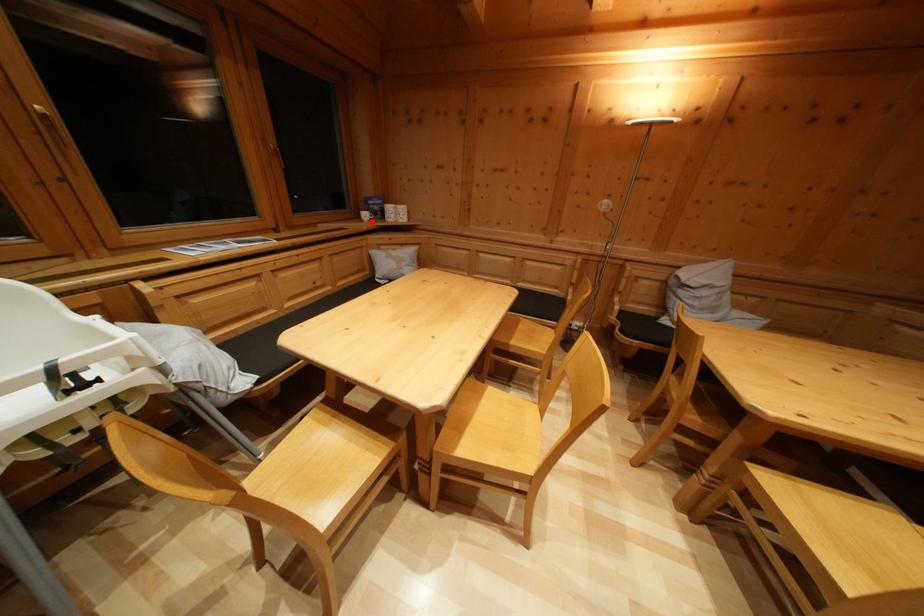
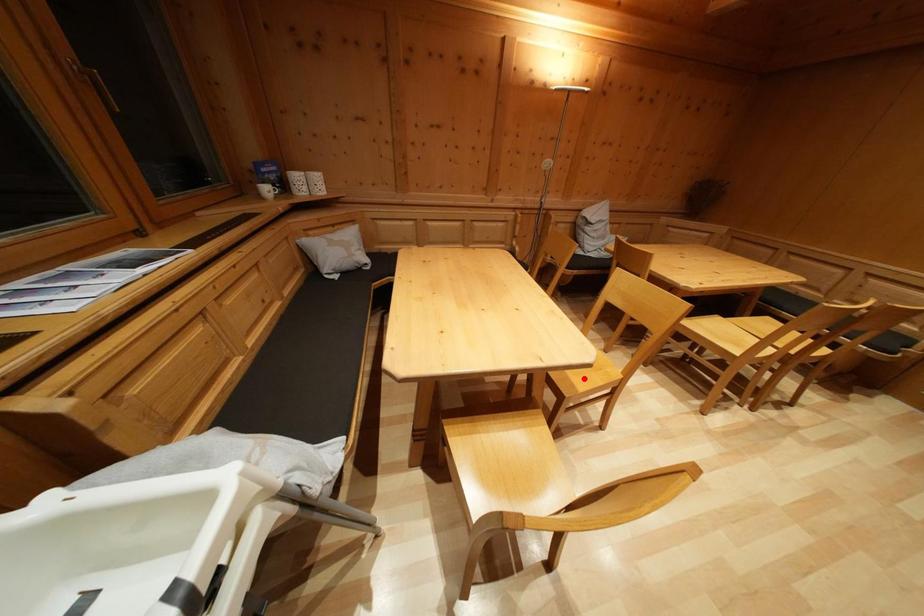
I am providing you with two images of the same scene from different viewpoints. A red point is marked on the first image and another point is marked on the second image. Do the highlighted points in image1 and image2 indicate the same real-world spot?

No